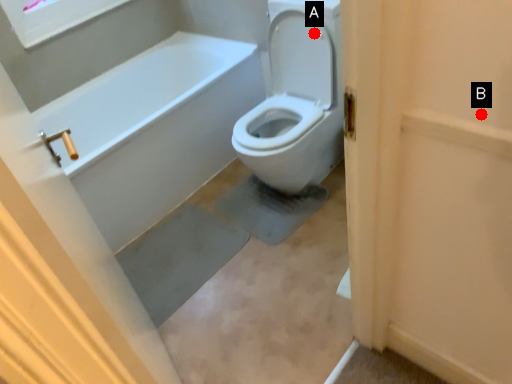
Question: Two points are circled on the image, labeled by A and B beside each circle. Among these points, which one is nearest to the camera?

Choices:
 (A) A is closer
 (B) B is closer

Answer: (B)